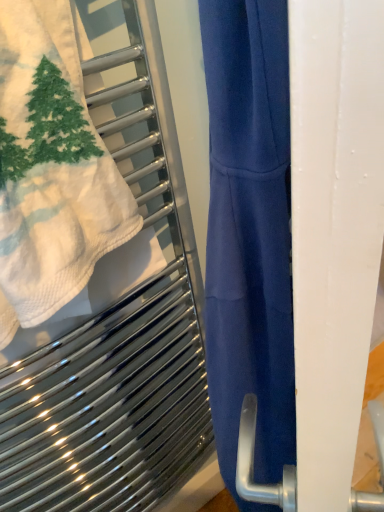
Question: In terms of height, does white textured towel at upper left look taller or shorter compared to white matte screen door at right?

Choices:
 (A) tall
 (B) short

Answer: (B)

Question: Do you think white textured towel at upper left is within white matte screen door at right, or outside of it?

Choices:
 (A) outside
 (B) inside

Answer: (A)

Question: Visually, is white textured towel at upper left positioned to the left or to the right of white matte screen door at right?

Choices:
 (A) left
 (B) right

Answer: (A)

Question: From a real-world perspective, is white matte screen door at right physically located above or below white textured towel at upper left?

Choices:
 (A) above
 (B) below

Answer: (B)

Question: From the image's perspective, is white matte screen door at right located above or below white textured towel at upper left?

Choices:
 (A) below
 (B) above

Answer: (A)

Question: Considering the positions of white matte screen door at right and white textured towel at upper left in the image, is white matte screen door at right wider or thinner than white textured towel at upper left?

Choices:
 (A) thin
 (B) wide

Answer: (A)

Question: Considering the relative positions of white matte screen door at right and white textured towel at upper left in the image provided, is white matte screen door at right to the left or to the right of white textured towel at upper left?

Choices:
 (A) left
 (B) right

Answer: (B)